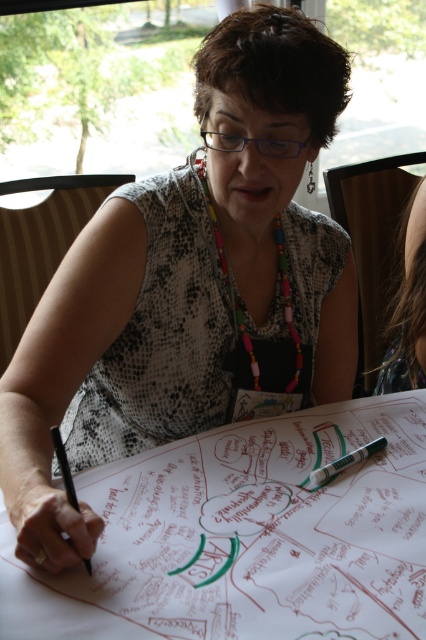
You are a photographer trying to capture a closeup of the green matte marker at center. The woman has dark brown hair at upper right. Do you think the hair might block the view of the marker?

The dark brown hair at upper right might be wider than green matte marker at center, so there is a possibility that the hair could block the view of the marker.

You are organizing a workshop and need to ensure that the green matte marker at center can fit entirely on the white paper at center. Based on the scene, can you confirm if the marker will fit on the paper?

The white paper at center is bigger than green matte marker at center, so yes, the green matte marker at center can fit entirely on the white paper at center.